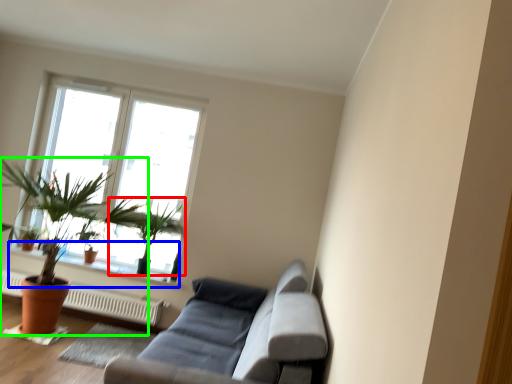
Question: Estimate the real-world distances between objects in this image. Which object is closer to houseplant (highlighted by a red box), window sill (highlighted by a blue box) or houseplant (highlighted by a green box)?

Choices:
 (A) window sill
 (B) houseplant

Answer: (B)